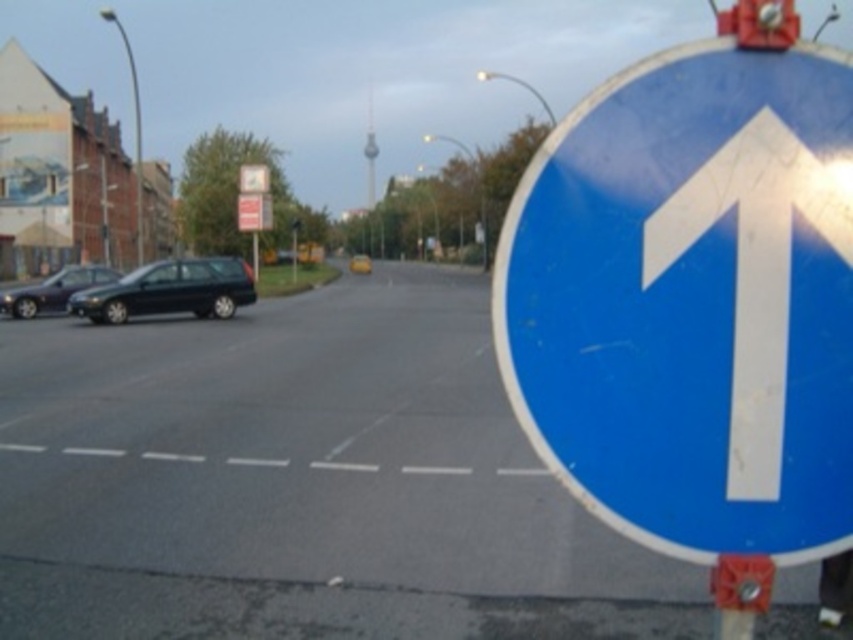
Is blue glossy sign at right shorter than metallic red traffic light at upper right?

Yes, blue glossy sign at right is shorter than metallic red traffic light at upper right.

From the picture: Is blue glossy sign at right above metallic red traffic light at upper right?

Actually, blue glossy sign at right is below metallic red traffic light at upper right.

The height and width of the screenshot is (640, 853). I want to click on blue glossy sign at right, so click(692, 301).

Is white plastic arrow at upper right thinner than matte black car at left?

Correct, white plastic arrow at upper right's width is less than matte black car at left's.

Is point (848, 205) positioned after point (64, 284)?

No, it is not.

Is point (773, 236) farther from camera compared to point (106, 269)?

No.

What are the coordinates of `white plastic arrow at upper right` in the screenshot? It's located at (756, 269).

Does blue glossy sign at right appear on the right side of white plastic arrow at upper right?

In fact, blue glossy sign at right is to the left of white plastic arrow at upper right.

Is blue glossy sign at right positioned in front of white plastic arrow at upper right?

No, blue glossy sign at right is behind white plastic arrow at upper right.

Does point (753, 172) lie in front of point (843, 198)?

Yes, point (753, 172) is closer to viewer.

Identify the location of blue glossy sign at right. Image resolution: width=853 pixels, height=640 pixels. (692, 301).